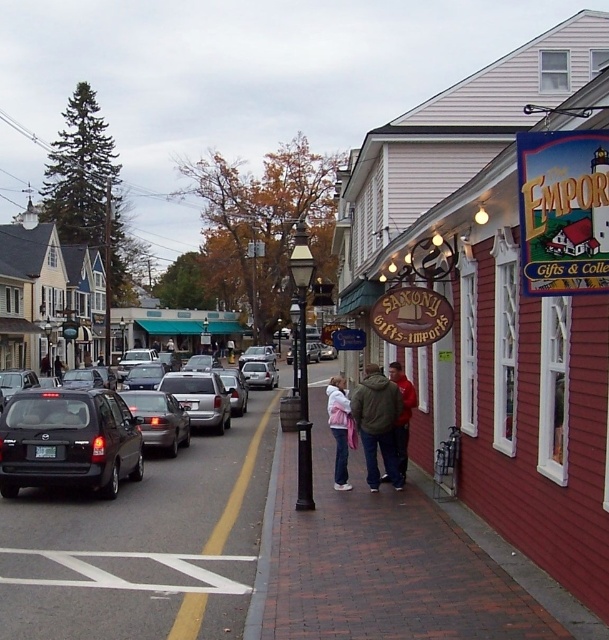
Question: Can you confirm if red wooden sign at right is positioned above matte black sedan at left?

Choices:
 (A) no
 (B) yes

Answer: (B)

Question: Is matte black suv at center-left wider than dark green jacket at center?

Choices:
 (A) yes
 (B) no

Answer: (A)

Question: Which object is the farthest from the dark green jacket at center?

Choices:
 (A) matte black suv at center-left
 (B) brick pavement at center

Answer: (A)

Question: Does red wooden sign at right have a greater width compared to matte black sedan at left?

Choices:
 (A) yes
 (B) no

Answer: (A)

Question: Which of these objects is positioned farthest from the matte black suv at center-left?

Choices:
 (A) matte black sedan at left
 (B) dark green jacket at center

Answer: (B)

Question: Estimate the real-world distances between objects in this image. Which object is closer to the dark green jacket at center?

Choices:
 (A) brick pavement at center
 (B) red wooden sign at right
 (C) matte black suv at center-left
 (D) matte black sedan at left

Answer: (A)